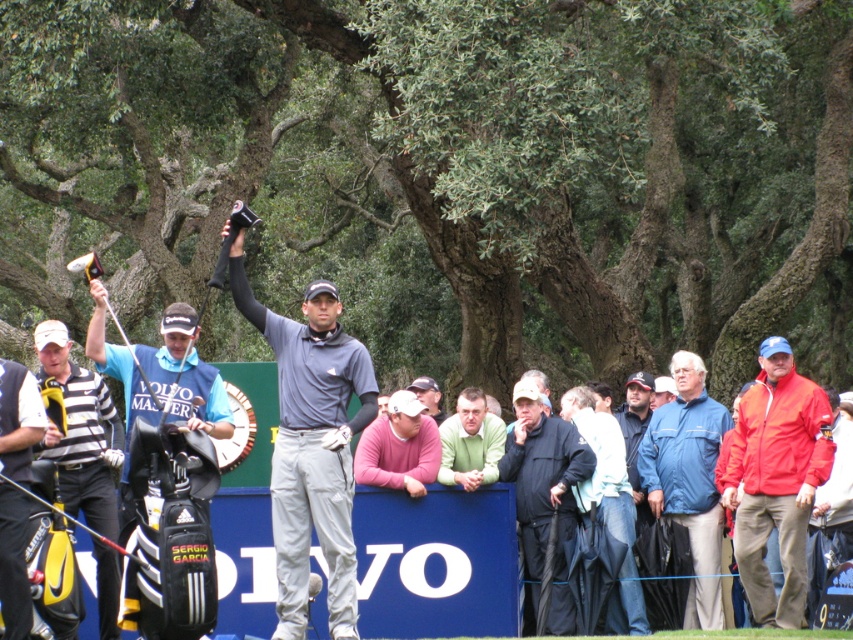
Question: Which point is farther to the camera?

Choices:
 (A) (383, 458)
 (B) (786, 369)
 (C) (543, 556)

Answer: (B)

Question: Is red fabric jacket at right below striped cotton polo shirt at left?

Choices:
 (A) no
 (B) yes

Answer: (A)

Question: Estimate the real-world distances between objects in this image. Which object is closer to the light blue denim jacket at center?

Choices:
 (A) matte blue vest at center
 (B) matte gray shirt at center
 (C) black matte jacket at center
 (D) black leather golf bag at left

Answer: (C)

Question: In this image, where is striped cotton polo shirt at left located relative to black leather golf bag at left?

Choices:
 (A) right
 (B) left

Answer: (A)

Question: Which object is farther from the camera taking this photo?

Choices:
 (A) blue fabric jacket at right
 (B) striped cotton polo shirt at left
 (C) black leather golf bag at left
 (D) matte blue vest at center

Answer: (A)

Question: Is red fabric jacket at right to the left of matte blue vest at center from the viewer's perspective?

Choices:
 (A) yes
 (B) no

Answer: (B)